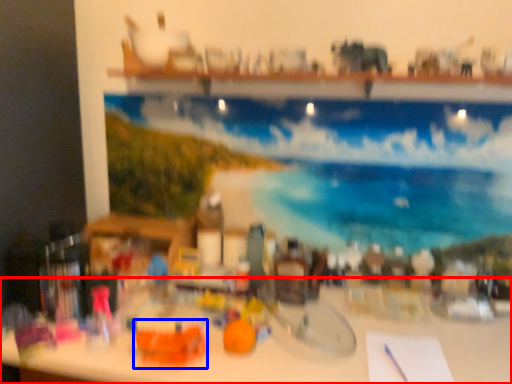
Question: Which object is further to the camera taking this photo, table (highlighted by a red box) or toy (highlighted by a blue box)?

Choices:
 (A) table
 (B) toy

Answer: (B)